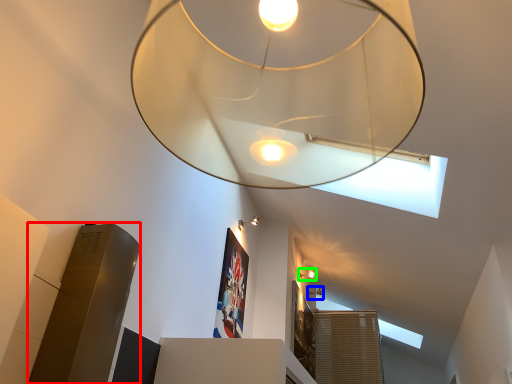
Question: Which object is the closest to the lift (highlighted by a red box)? Choose among these: lamp (highlighted by a blue box) or lamp (highlighted by a green box).

Choices:
 (A) lamp
 (B) lamp

Answer: (B)